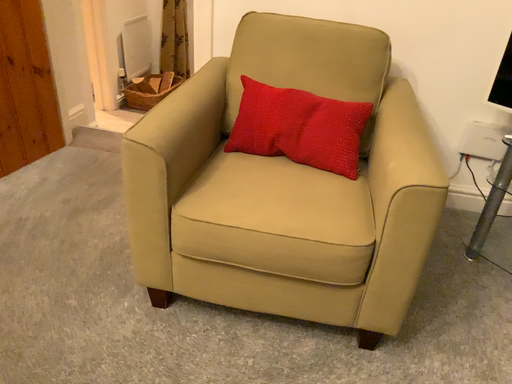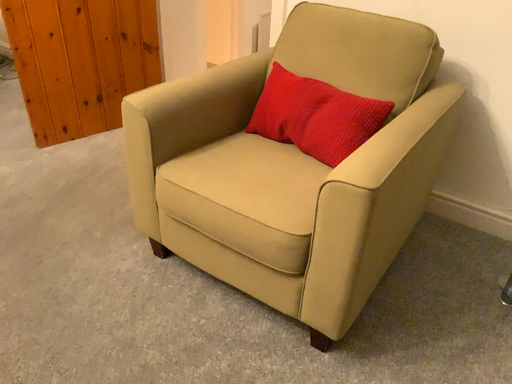
Question: Which way did the camera rotate in the video?

Choices:
 (A) rotated left
 (B) rotated right

Answer: (A)